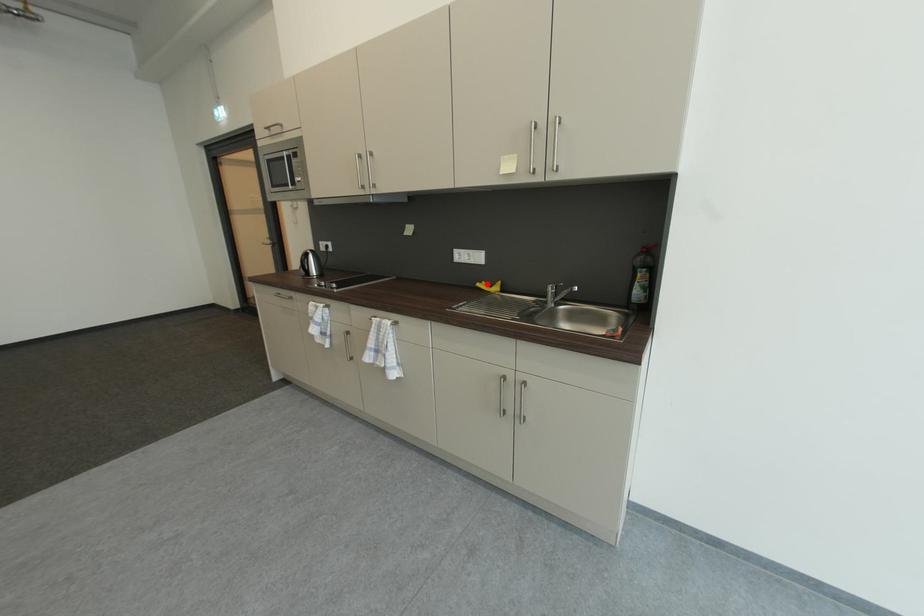
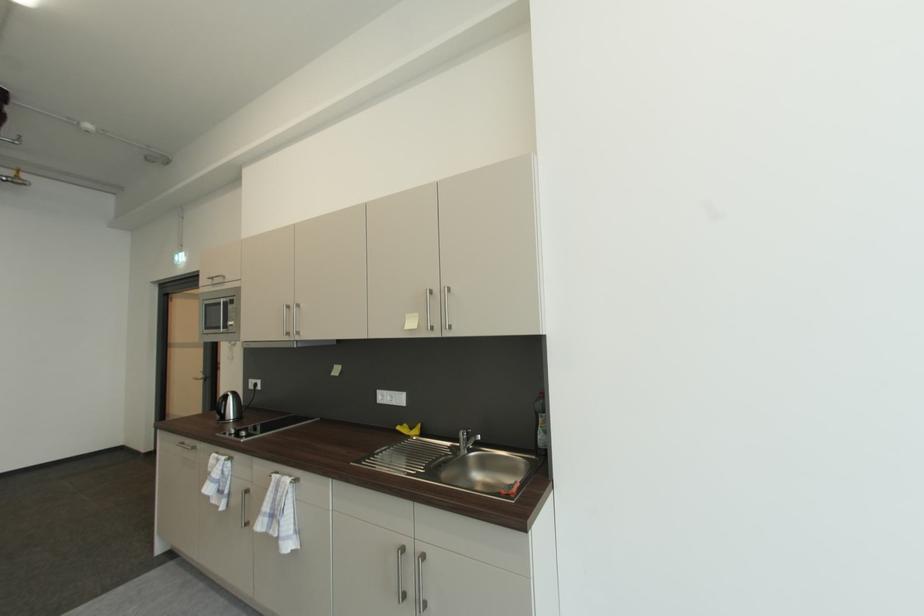
In the second image, find the point that corresponds to the highlighted location in the first image.

(408, 427)